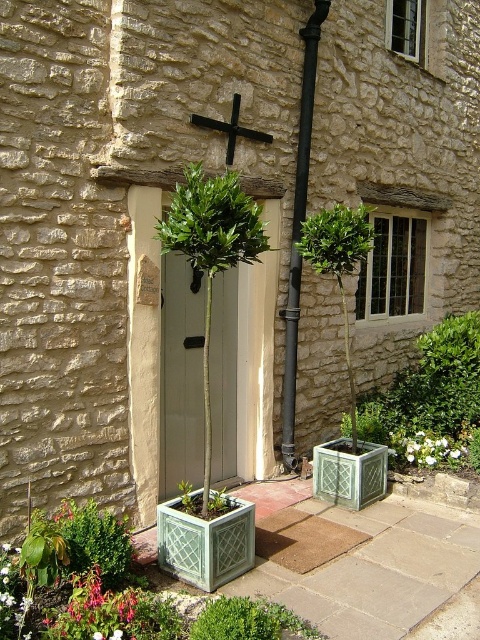
Question: Which object appears farthest from the camera in this image?

Choices:
 (A) white matte door at center
 (B) black metal cross at upper center
 (C) black metal pipe at center
 (D) green lattice planter at lower right

Answer: (D)

Question: Does green lattice planter at lower right appear on the left side of white matte flower at lower left?

Choices:
 (A) no
 (B) yes

Answer: (A)

Question: Which point is farther to the camera?

Choices:
 (A) (180, 426)
 (B) (404, 369)

Answer: (B)

Question: Which point is farther to the camera?

Choices:
 (A) white matte door at center
 (B) black metal pipe at center
 (C) black metal cross at upper center
 (D) white matte flower at lower left

Answer: (B)

Question: Does black metal pipe at center appear over white matte flower at lower left?

Choices:
 (A) no
 (B) yes

Answer: (B)

Question: Does black metal cross at upper center have a larger size compared to white matte flower at lower left?

Choices:
 (A) yes
 (B) no

Answer: (A)